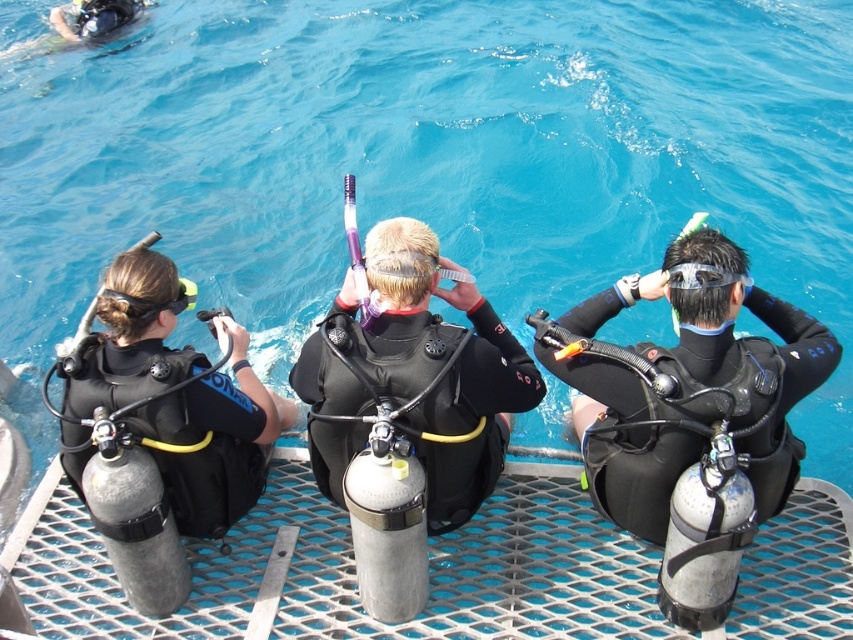
Question: Which point appears closest to the camera in this image?

Choices:
 (A) (265, 460)
 (B) (689, 259)
 (C) (415, 264)

Answer: (B)

Question: Estimate the real-world distances between objects in this image. Which object is farther from the black matte wetsuit at center?

Choices:
 (A) black matte wetsuit at left
 (B) black matte wetsuit at right

Answer: (B)

Question: Where is black matte wetsuit at right located in relation to black matte wetsuit at center in the image?

Choices:
 (A) above
 (B) below

Answer: (B)

Question: Which of the following is the farthest from the observer?

Choices:
 (A) black matte wetsuit at right
 (B) black matte wetsuit at center
 (C) black matte wetsuit at left

Answer: (B)

Question: Is black matte wetsuit at right above black matte wetsuit at center?

Choices:
 (A) no
 (B) yes

Answer: (A)

Question: Is black matte wetsuit at right in front of black matte wetsuit at center?

Choices:
 (A) no
 (B) yes

Answer: (B)